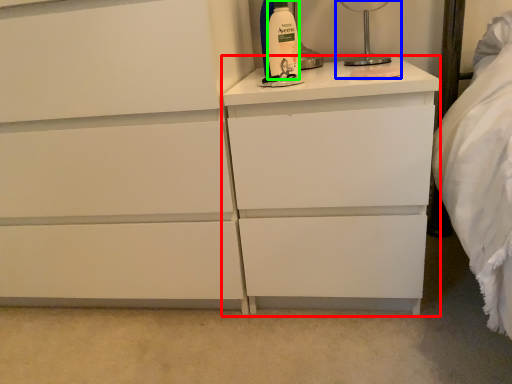
Question: Based on their relative distances, which object is nearer to nightstand (highlighted by a red box)? Choose from bedside lamp (highlighted by a blue box) and cleaning product (highlighted by a green box).

Choices:
 (A) bedside lamp
 (B) cleaning product

Answer: (B)